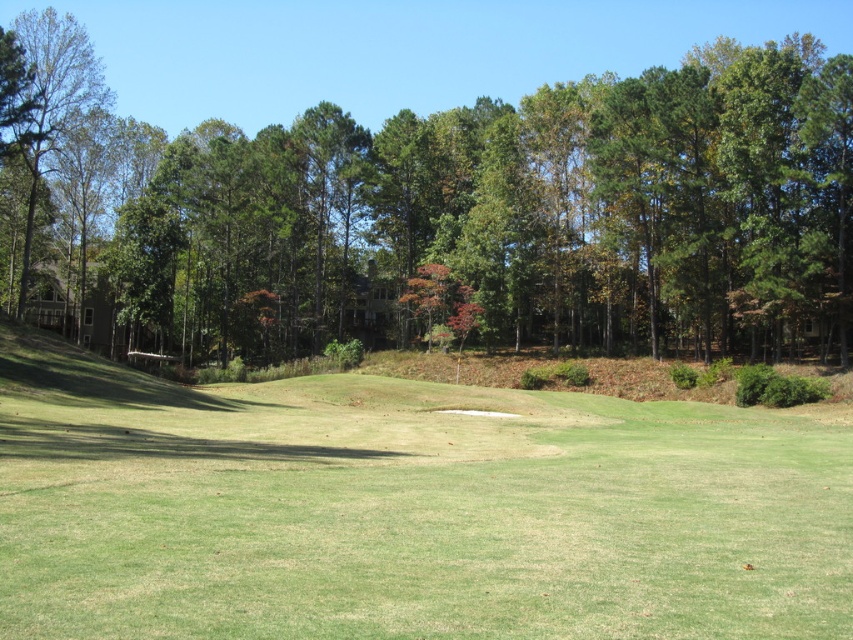
Does green grassy field at center have a lesser height compared to green leafy tree at center?

Indeed, green grassy field at center has a lesser height compared to green leafy tree at center.

Is the position of green grassy field at center less distant than that of green leafy tree at center?

Yes.

Which is behind, point (241, 515) or point (16, 200)?

The point (16, 200) is behind.

Locate an element on the screen. This screenshot has height=640, width=853. green grassy field at center is located at coordinates (405, 509).